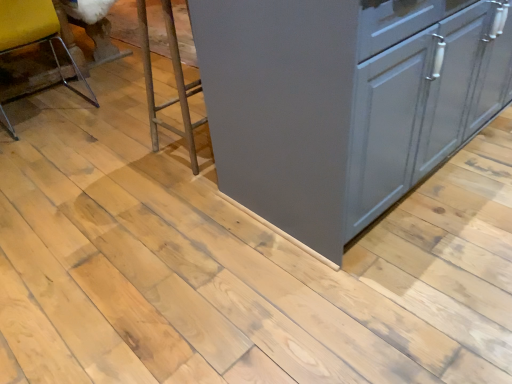
At what (x,y) coordinates should I click in order to perform the action: click on free space in front of metallic silver step stool at center. Please return your answer as a coordinate pair (x, y). Looking at the image, I should click on (176, 189).